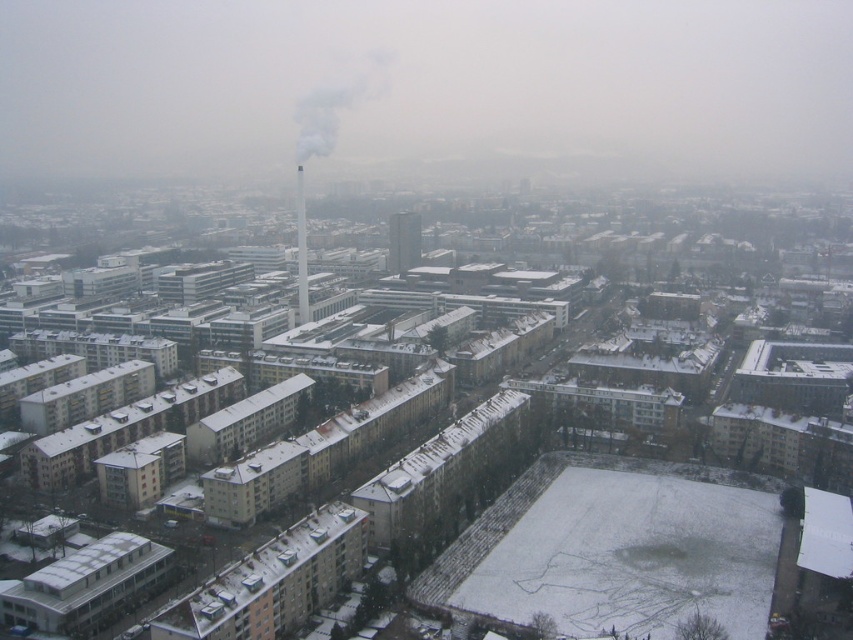
Question: Is snow-covered building at center below white smoke at center?

Choices:
 (A) no
 (B) yes

Answer: (B)

Question: Which of these objects is positioned closest to the white smoke at center?

Choices:
 (A) smooth concrete tower at center
 (B) smooth glass tower at center

Answer: (B)

Question: Which is farther from the snow-covered building at center?

Choices:
 (A) white smoke at center
 (B) smooth glass tower at center

Answer: (A)

Question: Does snow-covered building at center have a greater width compared to smooth glass tower at center?

Choices:
 (A) yes
 (B) no

Answer: (A)

Question: Which point is closer to the camera?

Choices:
 (A) smooth concrete tower at center
 (B) smooth glass tower at center
 (C) snow-covered building at center
 (D) white smoke at center

Answer: (C)

Question: Can you confirm if white smoke at center is smaller than smooth concrete tower at center?

Choices:
 (A) no
 (B) yes

Answer: (B)